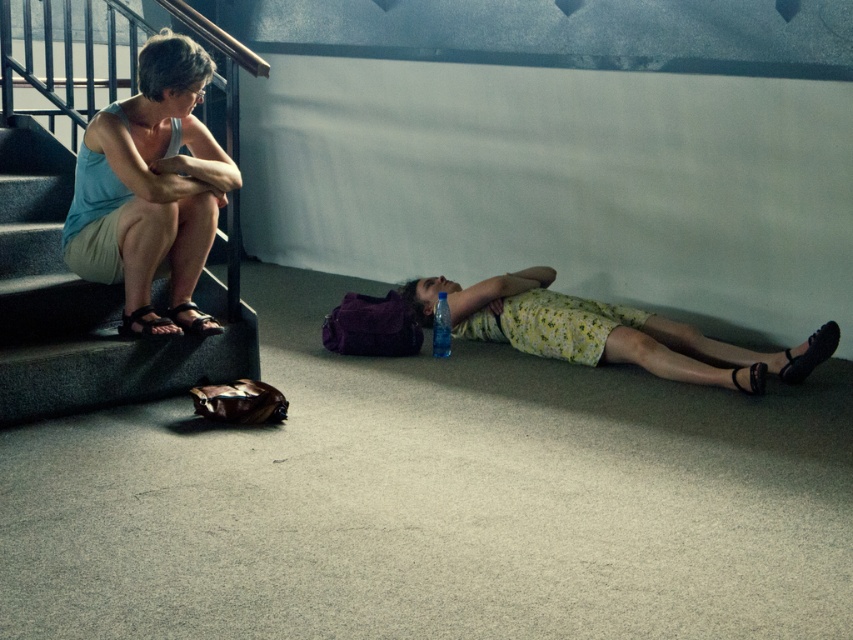
Question: Is light blue fabric tank top at upper left above brown fabric sandal at left?

Choices:
 (A) yes
 (B) no

Answer: (A)

Question: Can you confirm if brown fabric sandal at left is bigger than black leather sandal at lower right?

Choices:
 (A) yes
 (B) no

Answer: (A)

Question: Does matte concrete stairs at left have a larger size compared to black leather sandal at lower left?

Choices:
 (A) yes
 (B) no

Answer: (A)

Question: Which point is closer to the camera?

Choices:
 (A) black leather sandal at lower left
 (B) black fabric sandal at lower right

Answer: (A)

Question: Which of these objects is positioned closest to the clear plastic bottle at center?

Choices:
 (A) brown fabric sandal at left
 (B) matte concrete stairs at left
 (C) black leather sandal at lower right

Answer: (A)

Question: Which point is closer to the camera?

Choices:
 (A) light blue fabric tank top at upper left
 (B) yellow floral dress at lower center
 (C) black fabric sandal at lower right
 (D) clear plastic bottle at center

Answer: (A)